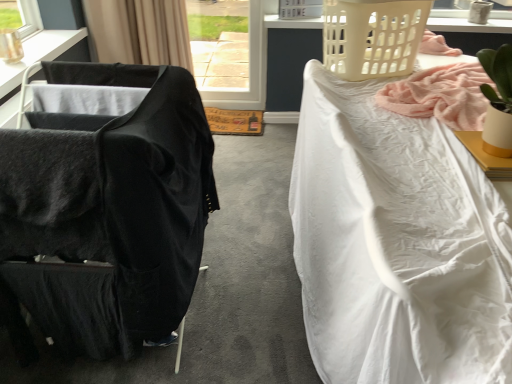
At what (x,y) coordinates should I click in order to perform the action: click on blank area to the left of white matte desk at upper right. Please return your answer as a coordinate pair (x, y). The image size is (512, 384). Looking at the image, I should click on (422, 162).